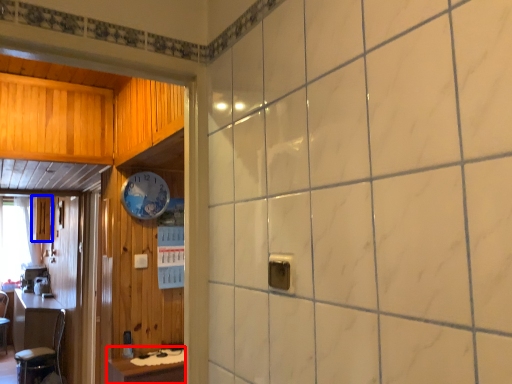
Question: Which of the following is the farthest to the observer, table (highlighted by a red box) or cabinetry (highlighted by a blue box)?

Choices:
 (A) table
 (B) cabinetry

Answer: (B)